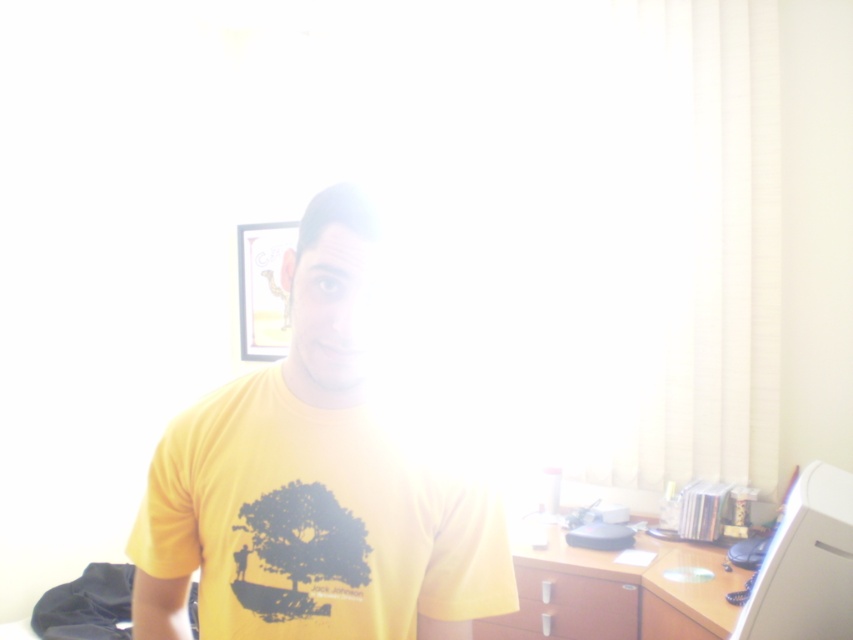
You are taking a photo of the desk cluttered with books and papers. You notice two points marked in the image. Which point, point (505, 625) or point (796, 563), is closer to the camera?

Point (505, 625) is further to the camera than point (796, 563), so point (505, 625) is closer to the camera.

You are organizing your study space and need to place a large textbook between the brown wood dresser at lower right and the white plastic computer at right. Which object should you place the textbook closer to if you want it to be near the larger item?

The brown wood dresser at lower right is bigger than the white plastic computer at right, so you should place the textbook closer to the brown wood dresser at lower right.